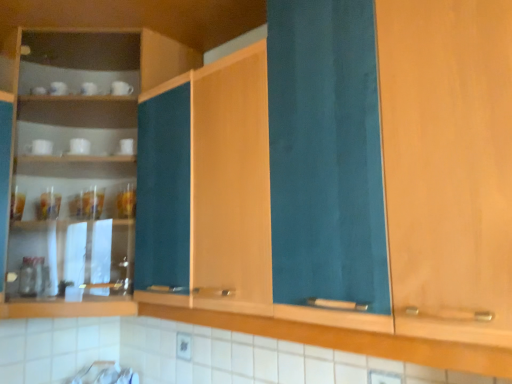
Question: Is teal fabric cabinet at center, which is counted as the 1th cabinetry, starting from the right, oriented away from white glossy cup at left?

Choices:
 (A) no
 (B) yes

Answer: (A)

Question: Is teal fabric cabinet at center, which is counted as the 2th cabinetry, starting from the left, far from white glossy cup at left?

Choices:
 (A) yes
 (B) no

Answer: (B)

Question: Is teal fabric cabinet at center, which is counted as the 1th cabinetry, starting from the right, further to camera compared to white glossy cup at left?

Choices:
 (A) yes
 (B) no

Answer: (B)

Question: Is the depth of teal fabric cabinet at center, which is counted as the 1th cabinetry, starting from the right, less than that of white glossy cup at left?

Choices:
 (A) no
 (B) yes

Answer: (B)

Question: Is teal fabric cabinet at center, which is counted as the 1th cabinetry, starting from the right, taller than white glossy cup at left?

Choices:
 (A) yes
 (B) no

Answer: (A)

Question: Is point (34, 140) closer or farther from the camera than point (100, 177)?

Choices:
 (A) closer
 (B) farther

Answer: (A)

Question: From their relative heights in the image, would you say white glossy cup at left is taller or shorter than wooden cabinet at left, the 2th cabinetry from the right?

Choices:
 (A) tall
 (B) short

Answer: (B)

Question: Considering their positions, is white glossy cup at left located in front of or behind wooden cabinet at left, which ranks as the first cabinetry in left-to-right order?

Choices:
 (A) front
 (B) behind

Answer: (B)

Question: From the image's perspective, is white glossy cup at left positioned above or below wooden cabinet at left, the 2th cabinetry from the right?

Choices:
 (A) above
 (B) below

Answer: (A)

Question: From a real-world perspective, is white glossy cup at left positioned above or below teal fabric cabinet at center, which is counted as the 2th cabinetry, starting from the left?

Choices:
 (A) above
 (B) below

Answer: (A)

Question: Is white glossy cup at left situated inside teal fabric cabinet at center, which is counted as the 1th cabinetry, starting from the right, or outside?

Choices:
 (A) outside
 (B) inside

Answer: (A)

Question: In terms of width, does white glossy cup at left look wider or thinner when compared to teal fabric cabinet at center, which is counted as the 2th cabinetry, starting from the left?

Choices:
 (A) thin
 (B) wide

Answer: (A)

Question: Is white glossy cup at left bigger or smaller than teal fabric cabinet at center, which is counted as the 2th cabinetry, starting from the left?

Choices:
 (A) big
 (B) small

Answer: (B)

Question: Looking at the image, does wooden cabinet at left, which ranks as the first cabinetry in left-to-right order, seem bigger or smaller compared to teal fabric cabinet at center, which is counted as the 1th cabinetry, starting from the right?

Choices:
 (A) big
 (B) small

Answer: (A)

Question: Considering their positions, is wooden cabinet at left, the 2th cabinetry from the right, located in front of or behind teal fabric cabinet at center, which is counted as the 2th cabinetry, starting from the left?

Choices:
 (A) front
 (B) behind

Answer: (B)